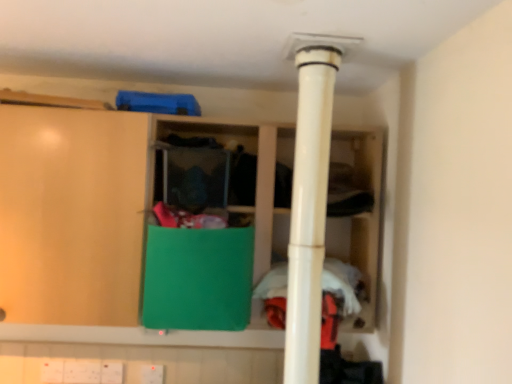
Question: From the image's perspective, does green matte cabinet at center appear lower than white plastic pipe at center?

Choices:
 (A) yes
 (B) no

Answer: (A)

Question: Would you say green matte cabinet at center is outside white plastic pipe at center?

Choices:
 (A) yes
 (B) no

Answer: (A)

Question: From the image's perspective, is green matte cabinet at center on top of white plastic pipe at center?

Choices:
 (A) no
 (B) yes

Answer: (A)

Question: Considering the relative sizes of green matte cabinet at center and white plastic pipe at center in the image provided, is green matte cabinet at center bigger than white plastic pipe at center?

Choices:
 (A) yes
 (B) no

Answer: (A)

Question: Does green matte cabinet at center lie behind white plastic pipe at center?

Choices:
 (A) no
 (B) yes

Answer: (B)

Question: Looking at their shapes, would you say green fabric at center is wider or thinner than white fabric at center?

Choices:
 (A) wide
 (B) thin

Answer: (A)

Question: From the image's perspective, relative to white fabric at center, is green fabric at center above or below?

Choices:
 (A) above
 (B) below

Answer: (A)

Question: Is green fabric at center inside or outside of white fabric at center?

Choices:
 (A) inside
 (B) outside

Answer: (B)

Question: In terms of size, does green fabric at center appear bigger or smaller than white fabric at center?

Choices:
 (A) big
 (B) small

Answer: (A)

Question: Does point (369, 278) appear closer or farther from the camera than point (292, 205)?

Choices:
 (A) closer
 (B) farther

Answer: (B)

Question: Considering the positions of green fabric at center and white plastic pipe at center in the image, is green fabric at center wider or thinner than white plastic pipe at center?

Choices:
 (A) thin
 (B) wide

Answer: (B)

Question: Considering the relative positions of green fabric at center and white plastic pipe at center in the image provided, is green fabric at center to the left or to the right of white plastic pipe at center?

Choices:
 (A) right
 (B) left

Answer: (B)

Question: From the image's perspective, is green fabric at center located above or below white plastic pipe at center?

Choices:
 (A) above
 (B) below

Answer: (A)

Question: Would you say white fabric at center is to the left or to the right of green matte cabinet at center in the picture?

Choices:
 (A) left
 (B) right

Answer: (B)

Question: From a real-world perspective, relative to green matte cabinet at center, is white fabric at center vertically above or below?

Choices:
 (A) above
 (B) below

Answer: (B)